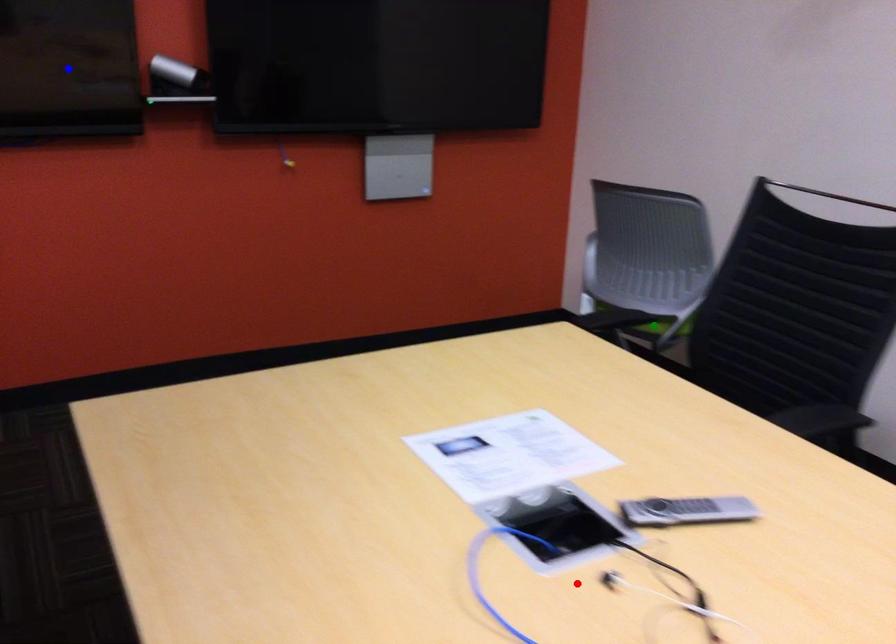
Order these from nearest to farthest:
blue point, red point, green point

1. red point
2. blue point
3. green point